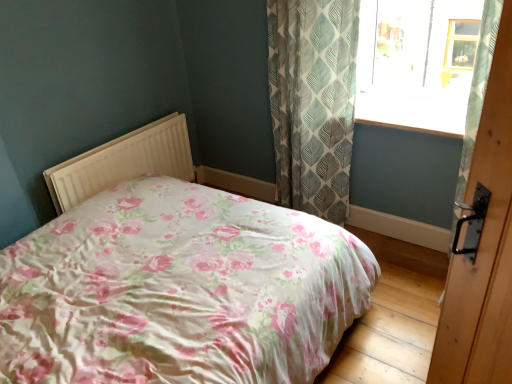
Describe the element at coordinates (123, 162) in the screenshot. I see `white plastic radiator at center` at that location.

What do you see at coordinates (173, 278) in the screenshot? I see `floral fabric bed at center` at bounding box center [173, 278].

The image size is (512, 384). What do you see at coordinates (419, 68) in the screenshot? I see `transparent glass window at upper right` at bounding box center [419, 68].

Locate an element on the screen. This screenshot has height=384, width=512. white plastic radiator at center is located at coordinates (123, 162).

Who is shorter, floral fabric bed at center or white plastic radiator at center?

With less height is white plastic radiator at center.

Can we say floral fabric bed at center lies outside white plastic radiator at center?

That's correct, floral fabric bed at center is outside of white plastic radiator at center.

Is floral fabric bed at center positioned far away from white plastic radiator at center?

They are positioned close to each other.

Is floral fabric bed at center wider than white plastic radiator at center?

Indeed, floral fabric bed at center has a greater width compared to white plastic radiator at center.

From a real-world perspective, does wooden door handle at right sit lower than green leaf-patterned fabric curtain at upper right?

Actually, wooden door handle at right is physically above green leaf-patterned fabric curtain at upper right in the real world.

What are the coordinates of `curtain behind the wooden door handle at right` in the screenshot? It's located at (313, 102).

Is wooden door handle at right wider or thinner than green leaf-patterned fabric curtain at upper right?

wooden door handle at right is thinner than green leaf-patterned fabric curtain at upper right.

From the image's perspective, which is below, wooden door handle at right or green leaf-patterned fabric curtain at upper right?

From the image's view, wooden door handle at right is below.

Is floral fabric bed at center further to camera compared to green leaf-patterned fabric curtain at upper right?

That is False.

From the image's perspective, is floral fabric bed at center beneath green leaf-patterned fabric curtain at upper right?

Yes, from the image's perspective, floral fabric bed at center is below green leaf-patterned fabric curtain at upper right.

Does point (250, 323) come behind point (283, 69)?

No, (250, 323) is closer to viewer.

Which object is positioned more to the right, floral fabric bed at center or green leaf-patterned fabric curtain at upper right?

Positioned to the right is green leaf-patterned fabric curtain at upper right.

Can you confirm if transparent glass window at upper right is positioned to the left of wooden door handle at right?

No, transparent glass window at upper right is not to the left of wooden door handle at right.

Who is taller, transparent glass window at upper right or wooden door handle at right?

wooden door handle at right is taller.

From the image's perspective, which object appears higher, transparent glass window at upper right or wooden door handle at right?

transparent glass window at upper right appears higher in the image.

The height and width of the screenshot is (384, 512). Identify the location of window on the right of wooden door handle at right. (419, 68).

Can you confirm if wooden door handle at right is thinner than white plastic radiator at center?

Yes, wooden door handle at right is thinner than white plastic radiator at center.

Is wooden door handle at right taller or shorter than white plastic radiator at center?

wooden door handle at right is taller than white plastic radiator at center.

Can you confirm if wooden door handle at right is positioned to the left of white plastic radiator at center?

In fact, wooden door handle at right is to the right of white plastic radiator at center.

From a real-world perspective, is wooden door handle at right physically located above or below floral fabric bed at center?

In terms of real-world spatial position, wooden door handle at right is above floral fabric bed at center.

Which object is thinner, wooden door handle at right or floral fabric bed at center?

wooden door handle at right.

From the image's perspective, which one is positioned higher, wooden door handle at right or floral fabric bed at center?

wooden door handle at right.

What are the coordinates of `curtain in front of the white plastic radiator at center` in the screenshot? It's located at (313, 102).

Is white plastic radiator at center located outside green leaf-patterned fabric curtain at upper right?

Yes, white plastic radiator at center is located beyond the bounds of green leaf-patterned fabric curtain at upper right.

Can you confirm if white plastic radiator at center is bigger than green leaf-patterned fabric curtain at upper right?

Incorrect, white plastic radiator at center is not larger than green leaf-patterned fabric curtain at upper right.

Is white plastic radiator at center shorter than green leaf-patterned fabric curtain at upper right?

Correct, white plastic radiator at center is not as tall as green leaf-patterned fabric curtain at upper right.

Identify the location of radiator located underneath the floral fabric bed at center (from a real-world perspective). The height and width of the screenshot is (384, 512). (123, 162).

Locate an element on the screen. Image resolution: width=512 pixels, height=384 pixels. curtain lying behind the wooden door handle at right is located at coordinates (313, 102).

From the image, which object appears to be nearer to white plastic radiator at center, transparent glass window at upper right or wooden door handle at right?

transparent glass window at upper right is positioned closer to the anchor white plastic radiator at center.

Based on their spatial positions, is white plastic radiator at center or wooden door handle at right closer to transparent glass window at upper right?

white plastic radiator at center lies closer to transparent glass window at upper right than the other object.

Which object lies further to the anchor point green leaf-patterned fabric curtain at upper right, transparent glass window at upper right or floral fabric bed at center?

Based on the image, floral fabric bed at center appears to be further to green leaf-patterned fabric curtain at upper right.

When comparing their distances from wooden door handle at right, does green leaf-patterned fabric curtain at upper right or transparent glass window at upper right seem further?

transparent glass window at upper right lies further to wooden door handle at right than the other object.

When comparing their distances from wooden door handle at right, does green leaf-patterned fabric curtain at upper right or floral fabric bed at center seem closer?

floral fabric bed at center is positioned closer to the anchor wooden door handle at right.

From the image, which object appears to be nearer to white plastic radiator at center, floral fabric bed at center or transparent glass window at upper right?

floral fabric bed at center.

Looking at the image, which one is located closer to transparent glass window at upper right, white plastic radiator at center or floral fabric bed at center?

floral fabric bed at center is positioned closer to the anchor transparent glass window at upper right.

Based on their spatial positions, is green leaf-patterned fabric curtain at upper right or transparent glass window at upper right further from floral fabric bed at center?

transparent glass window at upper right lies further to floral fabric bed at center than the other object.

Locate an element on the screen. door between white plastic radiator at center and transparent glass window at upper right from left to right is located at coordinates (484, 247).

Locate an element on the screen. The height and width of the screenshot is (384, 512). door located between floral fabric bed at center and white plastic radiator at center in the depth direction is located at coordinates (484, 247).

Identify the location of door between floral fabric bed at center and transparent glass window at upper right along the z-axis. This screenshot has height=384, width=512. (484, 247).

You are a GUI agent. You are given a task and a screenshot of the screen. Output one action in this format:
    pyautogui.click(x=<x>, y=<y>)
    Task: Click on the curtain between floral fabric bed at center and transparent glass window at upper right along the z-axis
    
    Given the screenshot: What is the action you would take?
    pyautogui.click(x=313, y=102)